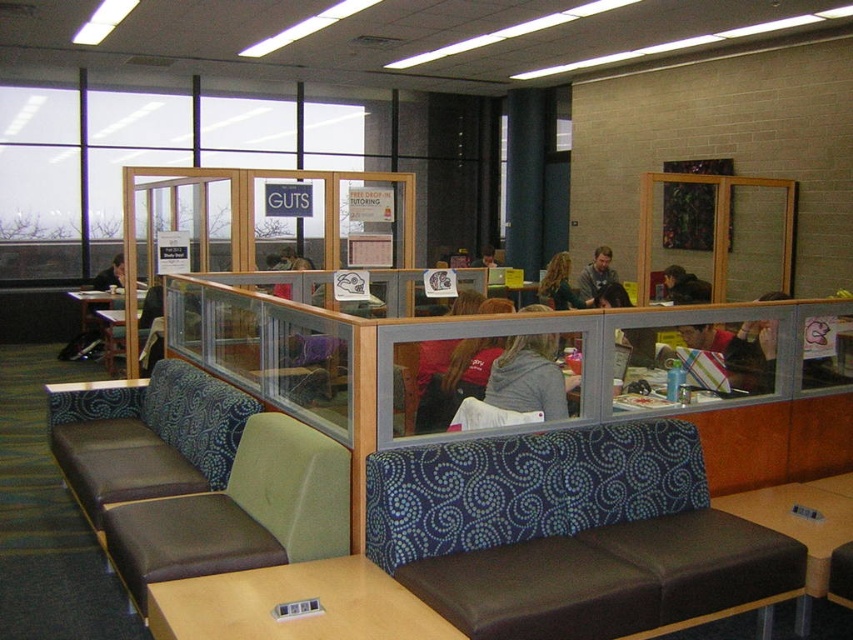
Does brown leather table at center appear under blonde hair at center?

Correct, brown leather table at center is located below blonde hair at center.

This screenshot has height=640, width=853. I want to click on brown leather table at center, so click(x=119, y=337).

Is blue patterned fabric couch at center in front of dark brown leather jacket at center?

Yes, it is.

The width and height of the screenshot is (853, 640). What do you see at coordinates (567, 532) in the screenshot? I see `blue patterned fabric couch at center` at bounding box center [567, 532].

This screenshot has width=853, height=640. What are the coordinates of `blue patterned fabric couch at center` in the screenshot? It's located at (567, 532).

Is brown leather couch at center to the right of smooth brown table at lower right from the viewer's perspective?

In fact, brown leather couch at center is to the left of smooth brown table at lower right.

The width and height of the screenshot is (853, 640). Identify the location of brown leather couch at center. (148, 436).